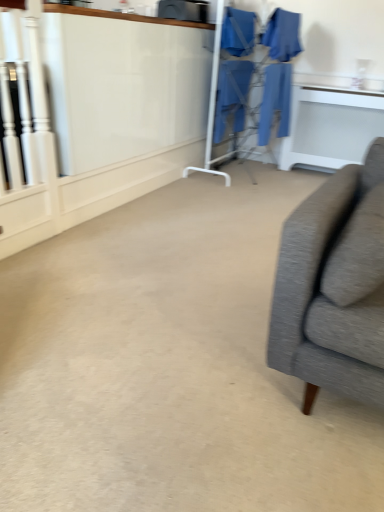
Where is `free space underneath blue fabric laundry at center (from a real-world perspective)`? free space underneath blue fabric laundry at center (from a real-world perspective) is located at coordinates coord(246,174).